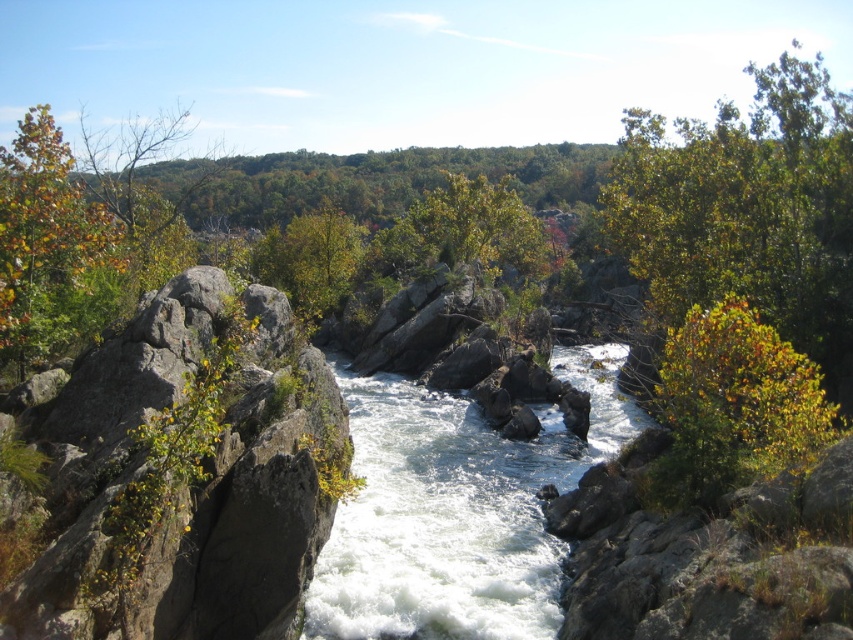
From the picture: You are standing at the edge of the river and want to cross to the other side. The white frothy water at center is in your path. Can you safely step onto the green leafy tree at center right to bypass the rapids?

The white frothy water at center is closer to you than the green leafy tree at center right, so stepping onto the green leafy tree at center right would require reaching further away, which might not be safe. It is advisable to find another way around.

You are a hiker trying to cross the river using the rocks. The gray rough rock at left and the white frothy water at center are in your path. Which object should you avoid stepping on to stay safe?

You should avoid stepping on the white frothy water at center because it indicates a swift current, while the gray rough rock at left is a stable surface.